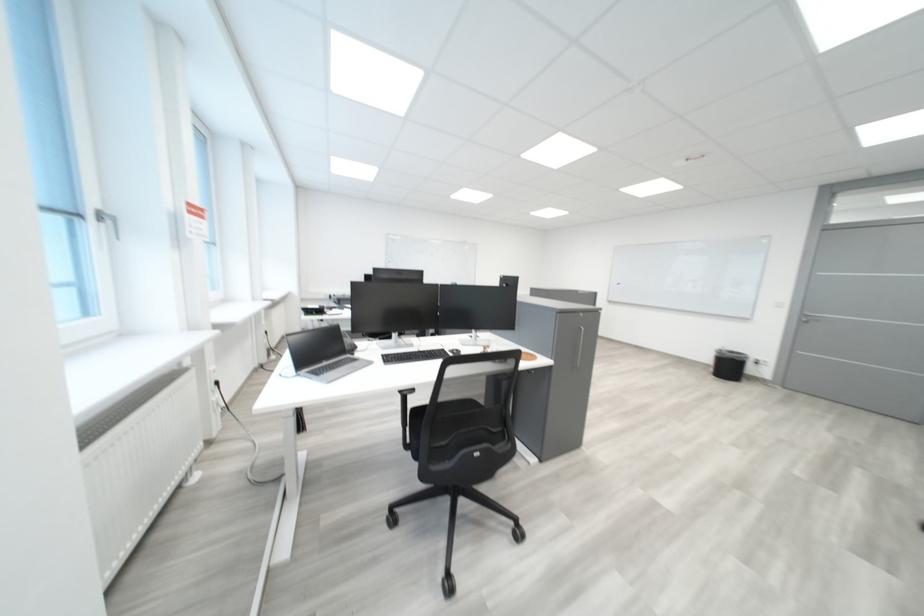
You are a GUI agent. You are given a task and a screenshot of the screen. Output one action in this format:
    pyautogui.click(x=<x>, y=<y>)
    Task: Click on the silver laptop
    This screenshot has width=924, height=616.
    Given the screenshot: What is the action you would take?
    coord(322,354)